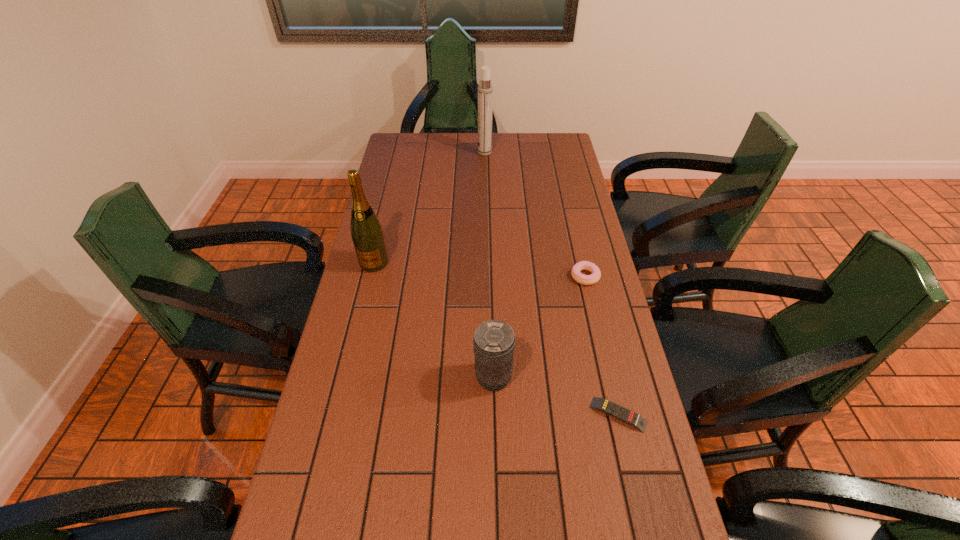
The height and width of the screenshot is (540, 960). What are the coordinates of `free space located on the side of the telephoto lens where the control switches are located` in the screenshot? It's located at (373, 377).

The image size is (960, 540). What are the coordinates of `vacant space located on the side of the telephoto lens where the control switches are located` in the screenshot? It's located at click(x=389, y=377).

Locate an element on the screen. free spot located 0.050m on the back of the doughnut is located at coordinates (581, 255).

This screenshot has width=960, height=540. I want to click on vacant space situated 0.070m on the back of the nearest object, so click(x=609, y=373).

This screenshot has height=540, width=960. In order to click on object located at the far edge in this screenshot , I will do `click(485, 89)`.

You are a GUI agent. You are given a task and a screenshot of the screen. Output one action in this format:
    pyautogui.click(x=<x>, y=<y>)
    Task: Click on the object that is at the left edge
    
    Given the screenshot: What is the action you would take?
    pyautogui.click(x=366, y=231)

I want to click on doughnut that is positioned at the right edge, so click(x=583, y=279).

Image resolution: width=960 pixels, height=540 pixels. What are the coordinates of `remote control present at the right edge` in the screenshot? It's located at [x=625, y=415].

Where is `vacant space at the far edge of the desktop`? Image resolution: width=960 pixels, height=540 pixels. vacant space at the far edge of the desktop is located at coordinates (524, 146).

In the image, there is a desktop. Where is `vacant space at the left edge`? Image resolution: width=960 pixels, height=540 pixels. vacant space at the left edge is located at coordinates (351, 293).